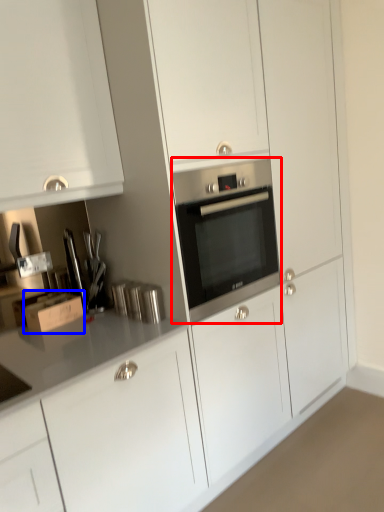
Question: Among these objects, which one is nearest to the camera, home appliance (highlighted by a red box) or cardboard box (highlighted by a blue box)?

Choices:
 (A) home appliance
 (B) cardboard box

Answer: (A)